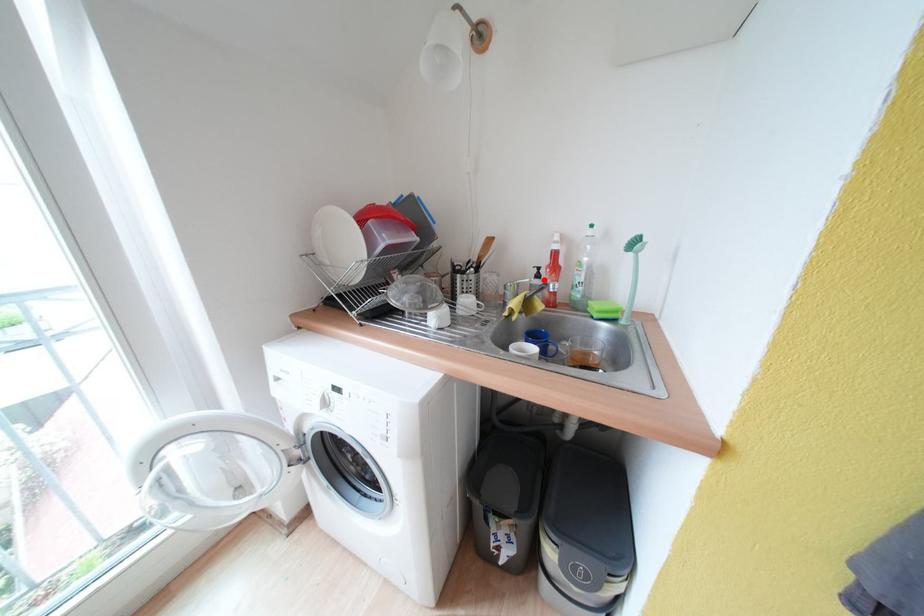
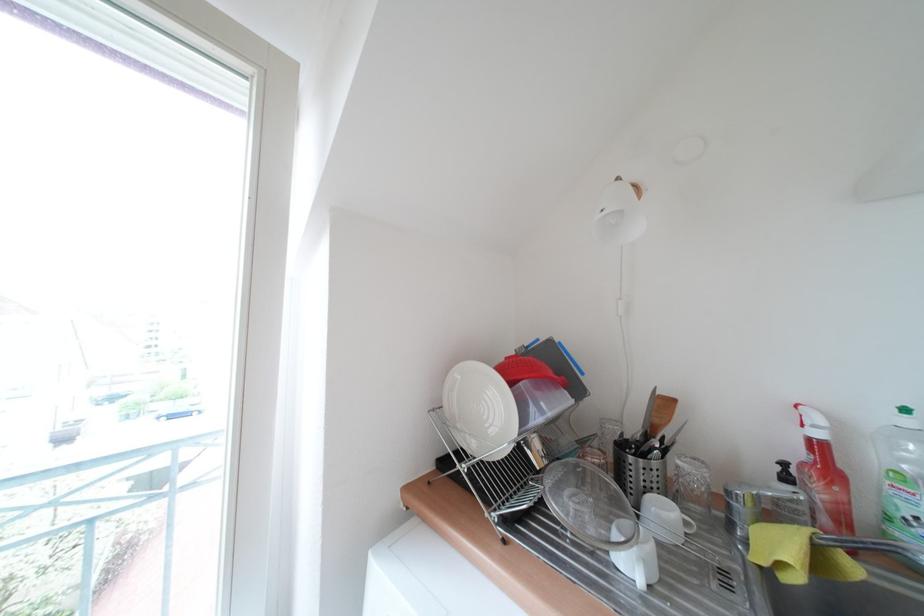
Where in the second image is the point corresponding to the highlighted location from the first image?

(793, 482)